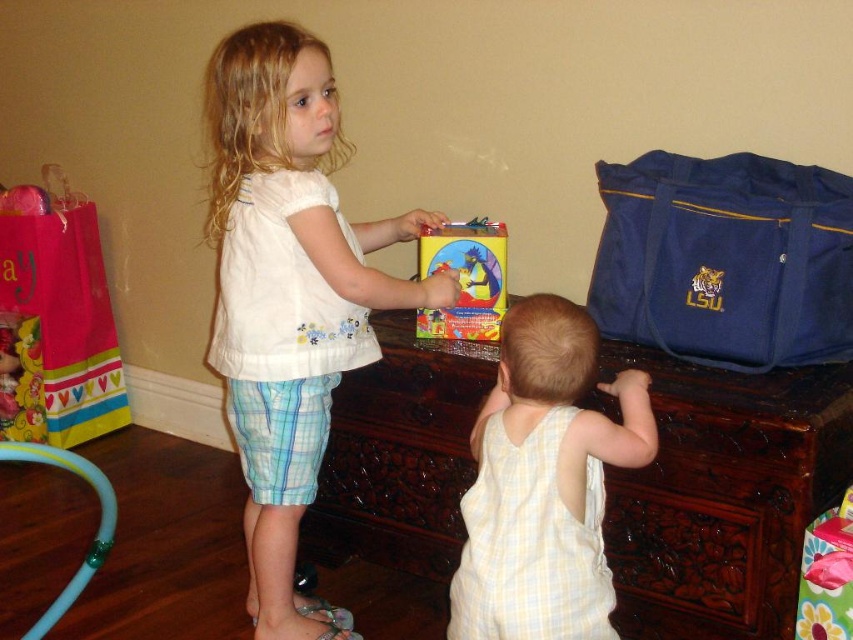
Consider the image. Does brown carved wood chest at center appear over light yellow checkered onesie at center?

Actually, brown carved wood chest at center is below light yellow checkered onesie at center.

Looking at this image, is brown carved wood chest at center further to the viewer compared to light yellow checkered onesie at center?

Yes, brown carved wood chest at center is behind light yellow checkered onesie at center.

Is point (619, 572) closer to viewer compared to point (485, 456)?

No, it is not.

Where is `brown carved wood chest at center`? This screenshot has width=853, height=640. brown carved wood chest at center is located at coordinates (723, 496).

Does brown carved wood chest at center lie in front of white cotton shirt at center?

Yes, brown carved wood chest at center is in front of white cotton shirt at center.

Which is in front, point (756, 460) or point (231, 376)?

Point (756, 460)

Find the location of a particular element. This screenshot has width=853, height=640. brown carved wood chest at center is located at coordinates (723, 496).

Is brown carved wood chest at center shorter than matte plastic book at center?

Incorrect, brown carved wood chest at center's height does not fall short of matte plastic book at center's.

Is point (366, 429) farther from camera compared to point (428, 259)?

Yes, it is behind point (428, 259).

The width and height of the screenshot is (853, 640). I want to click on brown carved wood chest at center, so click(x=723, y=496).

Identify the location of brown carved wood chest at center. This screenshot has width=853, height=640. (723, 496).